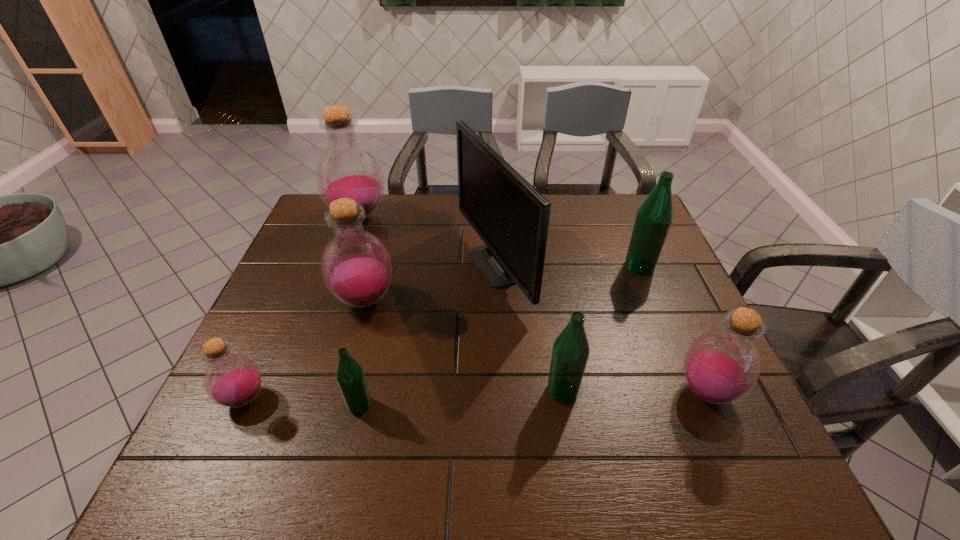
This screenshot has width=960, height=540. What are the coordinates of `the farthest purple bottle` in the screenshot? It's located at (346, 168).

Locate an element on the screen. Image resolution: width=960 pixels, height=540 pixels. the tallest bottle is located at coordinates tap(346, 168).

At what (x,y) coordinates should I click in order to perform the action: click on computer monitor. Please return your answer as a coordinate pair (x, y). The width and height of the screenshot is (960, 540). Looking at the image, I should click on (512, 218).

At what (x,y) coordinates should I click in order to perform the action: click on the sixth nearest bottle. Please return your answer as a coordinate pair (x, y). The width and height of the screenshot is (960, 540). Looking at the image, I should click on (654, 217).

Locate an element on the screen. the biggest green bottle is located at coordinates (654, 217).

Locate an element on the screen. the third nearest purple bottle is located at coordinates (356, 267).

Image resolution: width=960 pixels, height=540 pixels. I want to click on the third farthest bottle, so click(356, 267).

I want to click on the second biggest green bottle, so 570,352.

Where is `the third bottle from right to left`? The height and width of the screenshot is (540, 960). the third bottle from right to left is located at coordinates (570, 352).

In order to click on the rightmost purple bottle in this screenshot , I will do `click(720, 367)`.